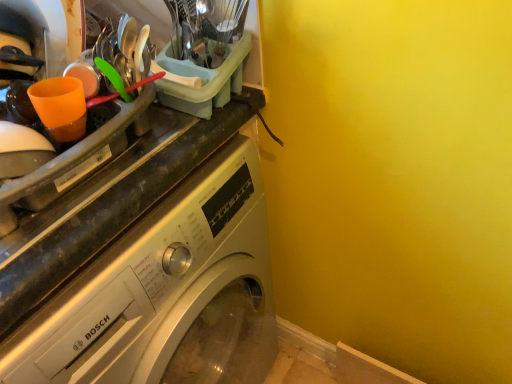
The width and height of the screenshot is (512, 384). I want to click on satin silver washing machine at upper left, so pos(166,293).

The height and width of the screenshot is (384, 512). What do you see at coordinates (166, 293) in the screenshot?
I see `satin silver washing machine at upper left` at bounding box center [166, 293].

Consider the image. In order to face satin silver washing machine at upper left, should I rotate leftwards or rightwards?

It's best to rotate left around 16.914 degrees.

This screenshot has width=512, height=384. I want to click on satin silver washing machine at upper left, so click(x=166, y=293).